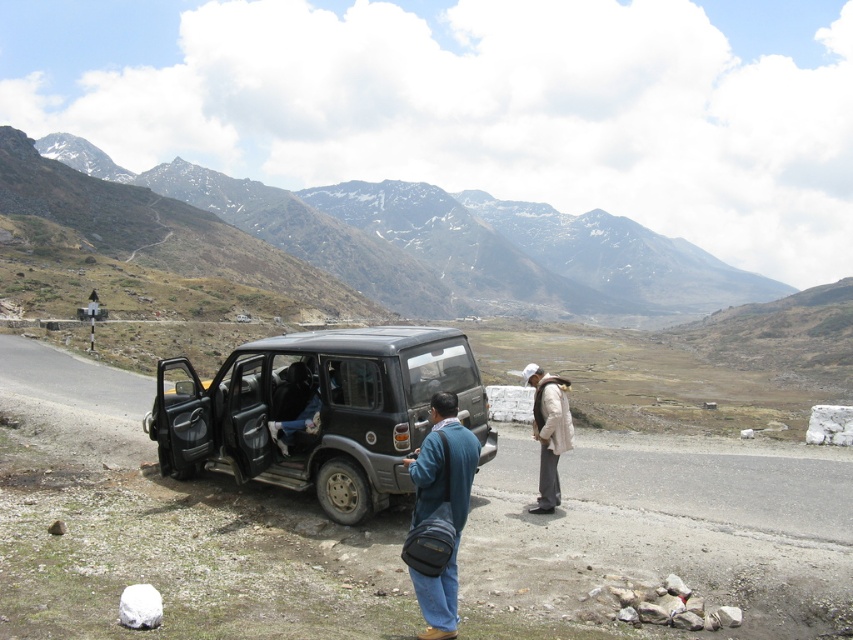
In the scene shown: Does white woolen jacket at center lie behind dark blue fabric pants at center?

No, white woolen jacket at center is in front of dark blue fabric pants at center.

This screenshot has height=640, width=853. Find the location of `white woolen jacket at center`. white woolen jacket at center is located at coordinates (549, 432).

Locate an element on the screen. The image size is (853, 640). white woolen jacket at center is located at coordinates (549, 432).

Is blue fabric bag at center behind white woolen jacket at center?

No, blue fabric bag at center is in front of white woolen jacket at center.

What do you see at coordinates (440, 502) in the screenshot? The width and height of the screenshot is (853, 640). I see `blue fabric bag at center` at bounding box center [440, 502].

Locate an element on the screen. The height and width of the screenshot is (640, 853). blue fabric bag at center is located at coordinates (440, 502).

Is matte black jeep at center above dark blue fabric pants at center?

Actually, matte black jeep at center is below dark blue fabric pants at center.

Does matte black jeep at center have a lesser width compared to dark blue fabric pants at center?

In fact, matte black jeep at center might be wider than dark blue fabric pants at center.

Identify the location of matte black jeep at center. (318, 412).